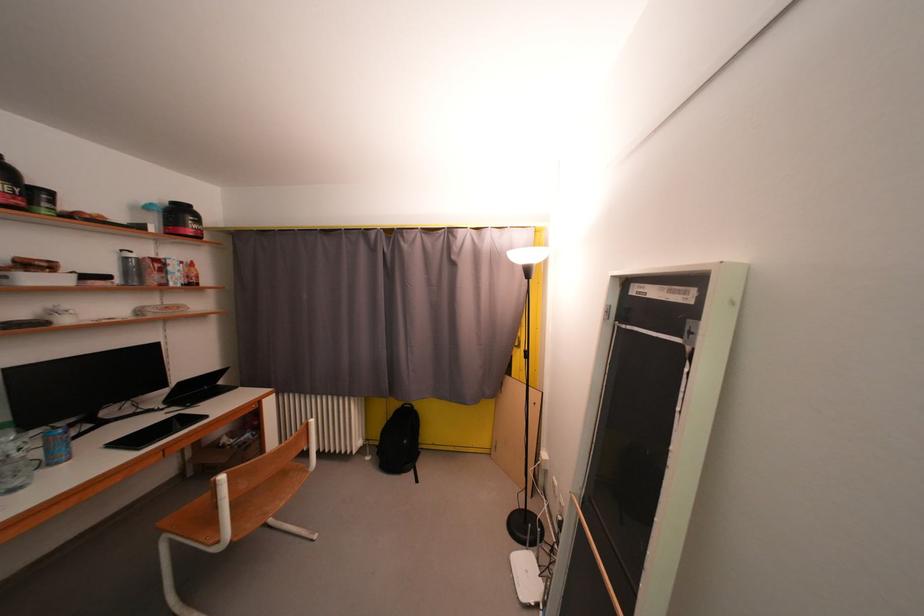
Locate an element on the screen. chair sitting surface is located at coordinates (200, 520).